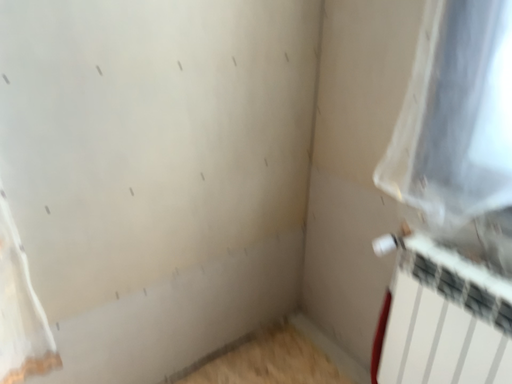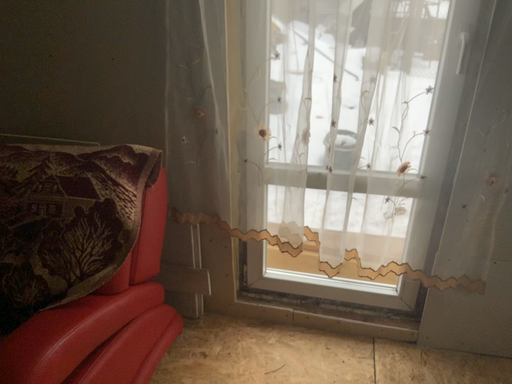
Question: Which way did the camera rotate in the video?

Choices:
 (A) rotated upward
 (B) rotated downward

Answer: (A)